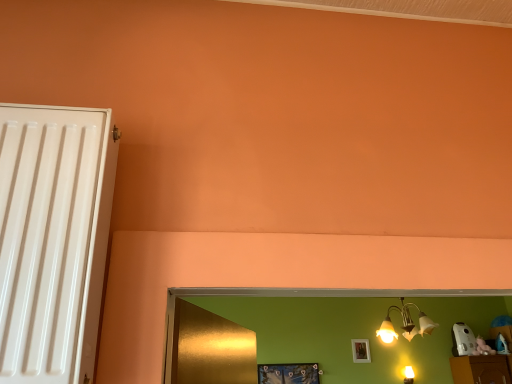
Question: Do you think white matte picture frame at upper center, arranged as the 2th picture frame when viewed from the front, is within metallic gold chandelier at upper right, or outside of it?

Choices:
 (A) outside
 (B) inside

Answer: (A)

Question: Is white matte picture frame at upper center, arranged as the 2th picture frame when viewed from the front, wider or thinner than metallic gold chandelier at upper right?

Choices:
 (A) thin
 (B) wide

Answer: (A)

Question: Estimate the real-world distances between objects in this image. Which object is farther from the metallic gold chandelier at upper right?

Choices:
 (A) white matte picture frame at upper center, acting as the 2th picture frame starting from the left
 (B) metallic blue picture frame at lower center, the first picture frame when ordered from left to right

Answer: (B)

Question: Estimate the real-world distances between objects in this image. Which object is closer to the metallic blue picture frame at lower center, the 1th picture frame in the front-to-back sequence?

Choices:
 (A) white matte picture frame at upper center, which appears as the 1th picture frame when viewed from the right
 (B) metallic gold chandelier at upper right

Answer: (A)